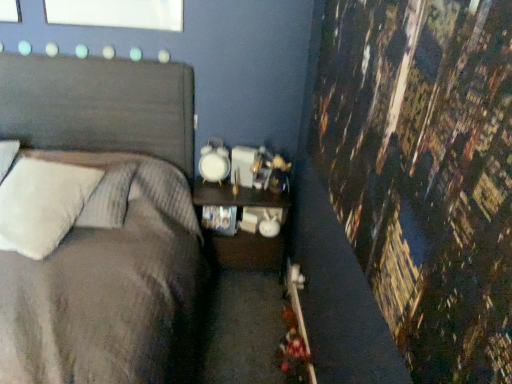
Question: Should I look upward or downward to see textured gray bed at left?

Choices:
 (A) up
 (B) down

Answer: (B)

Question: Is wooden nightstand at center aimed at white fluffy pillow at left?

Choices:
 (A) yes
 (B) no

Answer: (B)

Question: From the image's perspective, is wooden nightstand at center beneath white fluffy pillow at left?

Choices:
 (A) no
 (B) yes

Answer: (B)

Question: Does wooden nightstand at center have a lesser width compared to white fluffy pillow at left?

Choices:
 (A) yes
 (B) no

Answer: (A)

Question: Considering the relative sizes of wooden nightstand at center and white fluffy pillow at left in the image provided, is wooden nightstand at center wider than white fluffy pillow at left?

Choices:
 (A) no
 (B) yes

Answer: (A)

Question: Considering the relative sizes of wooden nightstand at center and white fluffy pillow at left in the image provided, is wooden nightstand at center smaller than white fluffy pillow at left?

Choices:
 (A) yes
 (B) no

Answer: (B)

Question: From a real-world perspective, does wooden nightstand at center stand above white fluffy pillow at left?

Choices:
 (A) yes
 (B) no

Answer: (B)

Question: Considering the relative sizes of white fluffy pillow at left and textured gray bed at left in the image provided, is white fluffy pillow at left smaller than textured gray bed at left?

Choices:
 (A) yes
 (B) no

Answer: (A)

Question: Would you say white fluffy pillow at left is outside textured gray bed at left?

Choices:
 (A) yes
 (B) no

Answer: (B)

Question: Does white fluffy pillow at left contain textured gray bed at left?

Choices:
 (A) no
 (B) yes

Answer: (A)

Question: Does white fluffy pillow at left have a lesser width compared to textured gray bed at left?

Choices:
 (A) no
 (B) yes

Answer: (B)

Question: Is the depth of white fluffy pillow at left greater than that of textured gray bed at left?

Choices:
 (A) no
 (B) yes

Answer: (B)

Question: Is white fluffy pillow at left positioned with its back to textured gray bed at left?

Choices:
 (A) yes
 (B) no

Answer: (A)

Question: Can you confirm if textured gray bed at left is bigger than wooden nightstand at center?

Choices:
 (A) yes
 (B) no

Answer: (A)